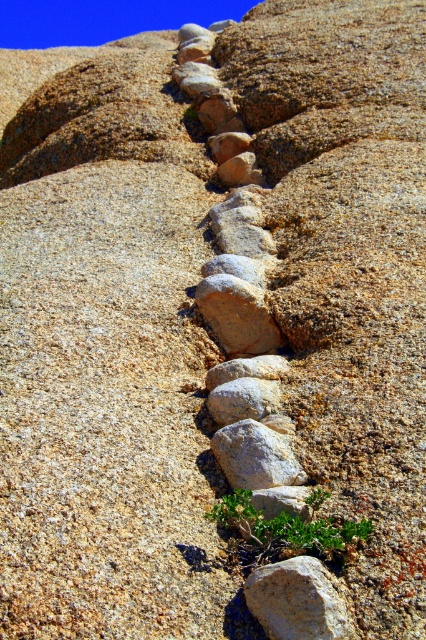
The image size is (426, 640). What do you see at coordinates (299, 600) in the screenshot?
I see `gray rough rock at center` at bounding box center [299, 600].

Which is behind, point (333, 605) or point (230, 461)?

Positioned behind is point (230, 461).

Which is behind, point (284, 592) or point (273, 474)?

Positioned behind is point (273, 474).

Where is `gray rough rock at center`? This screenshot has width=426, height=640. gray rough rock at center is located at coordinates (299, 600).

In order to click on gray/granite rock at center in this screenshot , I will do `click(256, 456)`.

Describe the element at coordinates (256, 456) in the screenshot. The height and width of the screenshot is (640, 426). I see `gray/granite rock at center` at that location.

The width and height of the screenshot is (426, 640). I want to click on gray/granite rock at center, so click(256, 456).

Is green leafy plant at lower center closer to the viewer compared to smooth gray rock at center?

Yes, green leafy plant at lower center is closer to the viewer.

Can you confirm if green leafy plant at lower center is shorter than smooth gray rock at center?

No.

Find the location of a particular element. green leafy plant at lower center is located at coordinates (285, 531).

What are the coordinates of `green leafy plant at lower center` in the screenshot? It's located at (285, 531).